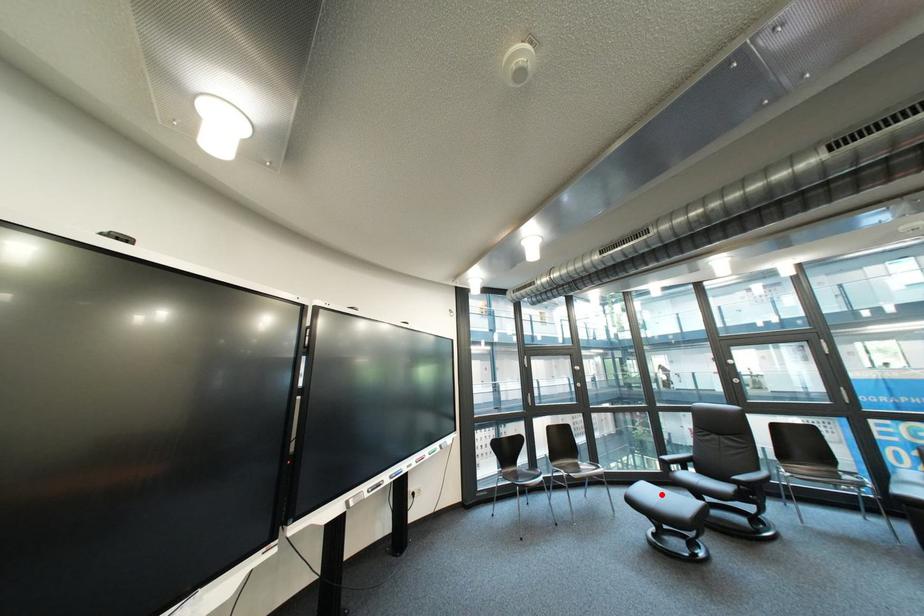
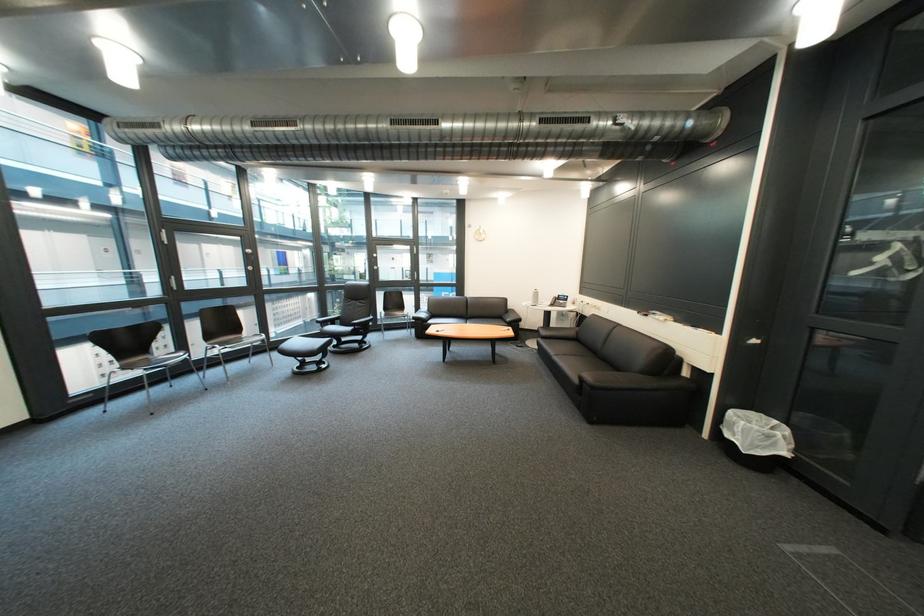
Locate, in the second image, the point that corresponds to the highlighted location in the first image.

(311, 345)